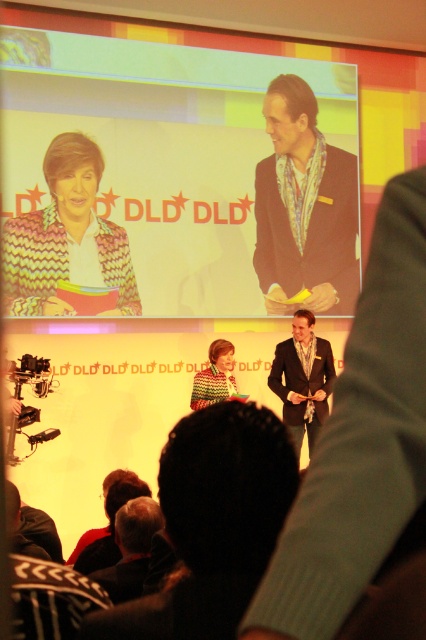
Question: Does shiny gold tie at center appear over patterned fabric suit at upper right?

Choices:
 (A) no
 (B) yes

Answer: (A)

Question: Does patterned fabric suit at upper right lie behind shiny gold suit at center?

Choices:
 (A) yes
 (B) no

Answer: (A)

Question: Among these points, which one is farthest from the camera?

Choices:
 (A) (340, 252)
 (B) (11, 556)

Answer: (A)

Question: Where is knitted multicolor sweater at upper left located in relation to shiny gold suit at center in the image?

Choices:
 (A) above
 (B) below

Answer: (A)

Question: Among these points, which one is nearest to the camera?

Choices:
 (A) (169, 604)
 (B) (51, 179)
 (C) (201, 388)
 (D) (388, 627)

Answer: (D)

Question: Among these objects, which one is nearest to the camera?

Choices:
 (A) knitted sweater at center
 (B) patterned suit at center

Answer: (B)